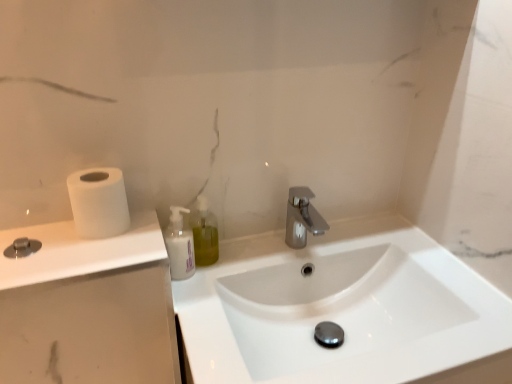
Question: Is translucent plastic soap dispenser at center next to white matte bottle at center?

Choices:
 (A) yes
 (B) no

Answer: (A)

Question: Considering the relative sizes of translucent plastic soap dispenser at center and white matte bottle at center in the image provided, is translucent plastic soap dispenser at center bigger than white matte bottle at center?

Choices:
 (A) yes
 (B) no

Answer: (B)

Question: Is translucent plastic soap dispenser at center aimed at white matte bottle at center?

Choices:
 (A) no
 (B) yes

Answer: (A)

Question: Can you confirm if translucent plastic soap dispenser at center is thinner than white matte bottle at center?

Choices:
 (A) yes
 (B) no

Answer: (A)

Question: Would you say white matte bottle at center is part of translucent plastic soap dispenser at center's contents?

Choices:
 (A) yes
 (B) no

Answer: (B)

Question: From the image's perspective, is translucent plastic soap dispenser at center on top of white matte bottle at center?

Choices:
 (A) yes
 (B) no

Answer: (A)

Question: From the image's perspective, would you say white matte toilet paper at left is shown under white glossy sink at center?

Choices:
 (A) yes
 (B) no

Answer: (B)

Question: Is white matte toilet paper at left at the right side of white glossy sink at center?

Choices:
 (A) yes
 (B) no

Answer: (B)

Question: Is the surface of white matte toilet paper at left in direct contact with white glossy sink at center?

Choices:
 (A) yes
 (B) no

Answer: (B)

Question: Is white matte toilet paper at left positioned in front of white glossy sink at center?

Choices:
 (A) no
 (B) yes

Answer: (A)

Question: From the image's perspective, is white matte toilet paper at left on top of white glossy sink at center?

Choices:
 (A) yes
 (B) no

Answer: (A)

Question: From a real-world perspective, is white matte toilet paper at left over white glossy sink at center?

Choices:
 (A) no
 (B) yes

Answer: (B)

Question: Is white matte bottle at center a part of white matte countertop at left?

Choices:
 (A) yes
 (B) no

Answer: (B)